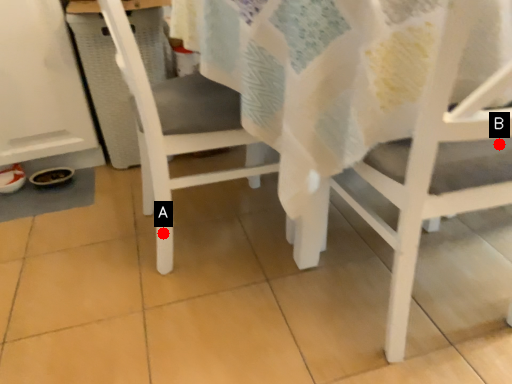
Question: Two points are circled on the image, labeled by A and B beside each circle. Which point appears farthest from the camera in this image?

Choices:
 (A) A is further
 (B) B is further

Answer: (A)